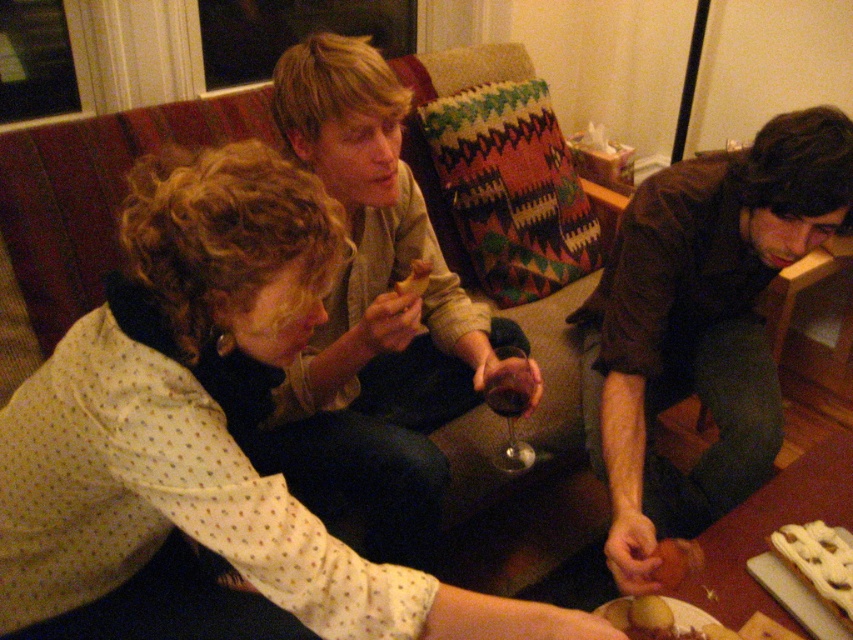
Which is more to the left, white dotted shirt at center or golden crispy potato at lower center?

Positioned to the left is white dotted shirt at center.

Is white dotted shirt at center shorter than golden crispy potato at lower center?

No.

Who is more forward, (45, 384) or (608, 604)?

Point (45, 384)

Where is `white dotted shirt at center`? white dotted shirt at center is located at coordinates (200, 435).

Between point (830, 545) and point (670, 547), which one is positioned in front?

Point (670, 547) is in front.

Does white glazed pastry at lower right come behind smooth brown bread at lower center?

No, it is in front of smooth brown bread at lower center.

Is point (798, 564) farther from camera compared to point (668, 564)?

Yes, point (798, 564) is farther from viewer.

The height and width of the screenshot is (640, 853). Identify the location of white glazed pastry at lower right. (817, 563).

Between point (370, 163) and point (619, 621), which one is positioned in front?

Point (619, 621)

Based on the photo, which is more to the left, matte beige sweater at center or golden crispy potato at lower center?

matte beige sweater at center is more to the left.

At what (x,y) coordinates should I click in order to perform the action: click on matte beige sweater at center. Please return your answer as a coordinate pair (x, y). Looking at the image, I should click on (374, 308).